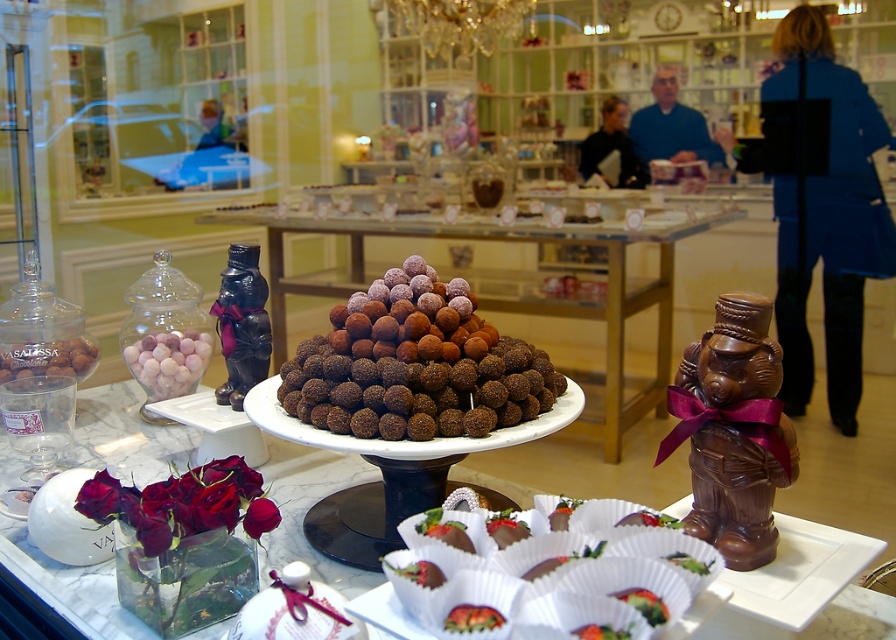
Between point (877, 432) and point (613, 177), which one is positioned in front?

Point (877, 432) is in front.

Is point (505, 456) farther from camera compared to point (602, 104)?

No, (505, 456) is in front of (602, 104).

This screenshot has width=896, height=640. Describe the element at coordinates (849, 467) in the screenshot. I see `shiny chocolate bear at right` at that location.

Where is `shiny chocolate bear at right`? The image size is (896, 640). shiny chocolate bear at right is located at coordinates (849, 467).

Is point (58, 99) more distant than point (369, 433)?

Yes, point (58, 99) is farther from viewer.

Which is more to the right, clear glass jar at upper left or chocolate truffles at center?

Positioned to the right is chocolate truffles at center.

What are the coordinates of `clear glass jar at upper left` in the screenshot? It's located at (149, 106).

Is point (780, 48) positioned behind point (533, 236)?

No, (780, 48) is in front of (533, 236).

Who is higher up, blue fabric coat at upper right or brown chocolate truffles at center?

blue fabric coat at upper right is higher up.

What do you see at coordinates (826, 218) in the screenshot?
I see `blue fabric coat at upper right` at bounding box center [826, 218].

Where is `blue fabric coat at upper right`? The image size is (896, 640). blue fabric coat at upper right is located at coordinates (826, 218).